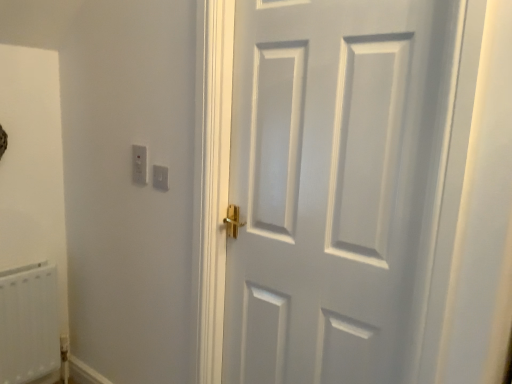
Question: From a real-world perspective, is white plastic light switch at upper left on top of white plastic radiator at lower left?

Choices:
 (A) yes
 (B) no

Answer: (A)

Question: Is there a large distance between white plastic light switch at upper left and white plastic radiator at lower left?

Choices:
 (A) no
 (B) yes

Answer: (A)

Question: Is white plastic light switch at upper left smaller than white plastic radiator at lower left?

Choices:
 (A) no
 (B) yes

Answer: (B)

Question: Is white plastic light switch at upper left behind white plastic radiator at lower left?

Choices:
 (A) no
 (B) yes

Answer: (A)

Question: Is white plastic light switch at upper left taller than white plastic radiator at lower left?

Choices:
 (A) no
 (B) yes

Answer: (A)

Question: Considering the relative positions of white plastic light switch at upper left and white plastic radiator at lower left in the image provided, is white plastic light switch at upper left to the right of white plastic radiator at lower left from the viewer's perspective?

Choices:
 (A) no
 (B) yes

Answer: (B)

Question: Is white matte door at center smaller than white plastic light switch at upper left?

Choices:
 (A) yes
 (B) no

Answer: (B)

Question: From the image's perspective, is white matte door at center located above white plastic light switch at upper left?

Choices:
 (A) no
 (B) yes

Answer: (A)

Question: Considering the relative positions of white matte door at center and white plastic light switch at upper left in the image provided, is white matte door at center to the right of white plastic light switch at upper left from the viewer's perspective?

Choices:
 (A) no
 (B) yes

Answer: (B)

Question: Is white matte door at center facing towards white plastic light switch at upper left?

Choices:
 (A) no
 (B) yes

Answer: (A)

Question: Is white matte door at center taller than white plastic light switch at upper left?

Choices:
 (A) no
 (B) yes

Answer: (B)

Question: Is white plastic light switch at upper left completely or partially inside white matte door at center?

Choices:
 (A) yes
 (B) no

Answer: (B)

Question: Could you tell me if white plastic radiator at lower left is facing white matte door at center?

Choices:
 (A) yes
 (B) no

Answer: (A)